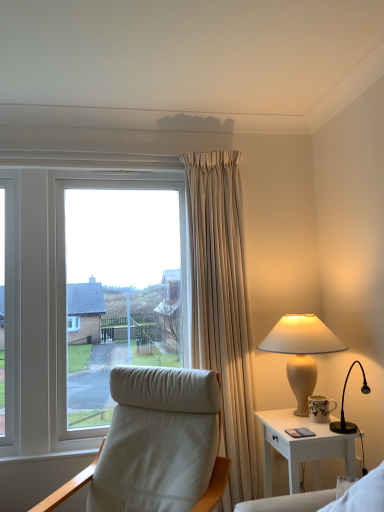
Question: Is white leather couch at lower right facing towards white leather chair at left?

Choices:
 (A) yes
 (B) no

Answer: (B)

Question: Can you confirm if white leather couch at lower right is bigger than white leather chair at left?

Choices:
 (A) no
 (B) yes

Answer: (A)

Question: Considering the relative sizes of white leather couch at lower right and white leather chair at left in the image provided, is white leather couch at lower right shorter than white leather chair at left?

Choices:
 (A) no
 (B) yes

Answer: (B)

Question: Considering the relative positions of white leather couch at lower right and white leather chair at left in the image provided, is white leather couch at lower right in front of white leather chair at left?

Choices:
 (A) yes
 (B) no

Answer: (A)

Question: Does white leather couch at lower right come behind white leather chair at left?

Choices:
 (A) yes
 (B) no

Answer: (B)

Question: Does white leather couch at lower right have a greater height compared to white leather chair at left?

Choices:
 (A) no
 (B) yes

Answer: (A)

Question: From the image's perspective, is white leather chair at left below matte beige lamp at right?

Choices:
 (A) yes
 (B) no

Answer: (A)

Question: Does white leather chair at left have a lesser height compared to matte beige lamp at right?

Choices:
 (A) yes
 (B) no

Answer: (B)

Question: Is white leather chair at left to the right of matte beige lamp at right from the viewer's perspective?

Choices:
 (A) no
 (B) yes

Answer: (A)

Question: Is white leather chair at left far from matte beige lamp at right?

Choices:
 (A) no
 (B) yes

Answer: (B)

Question: Considering the relative sizes of white leather chair at left and matte beige lamp at right in the image provided, is white leather chair at left smaller than matte beige lamp at right?

Choices:
 (A) no
 (B) yes

Answer: (A)

Question: Considering the relative sizes of white leather chair at left and matte beige lamp at right in the image provided, is white leather chair at left bigger than matte beige lamp at right?

Choices:
 (A) no
 (B) yes

Answer: (B)

Question: Would you consider matte beige lamp at right to be distant from white glossy nightstand at right?

Choices:
 (A) yes
 (B) no

Answer: (B)